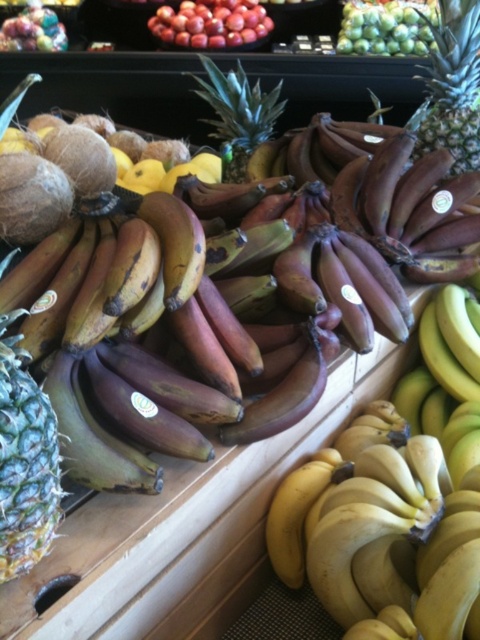
Question: Which object appears farthest from the camera in this image?

Choices:
 (A) yellow textured pineapple at lower left
 (B) shiny red apples at upper center
 (C) green textured pineapple at upper right
 (D) green matte grapes at upper center

Answer: (B)

Question: Is green textured pineapple at upper right behind green matte grapes at upper center?

Choices:
 (A) no
 (B) yes

Answer: (A)

Question: Which point is closer to the camera?

Choices:
 (A) (451, 12)
 (B) (368, 26)

Answer: (A)

Question: Is green spiky pineapple at center to the right of green matte grapes at upper center from the viewer's perspective?

Choices:
 (A) yes
 (B) no

Answer: (B)

Question: Is yellow textured pineapple at lower left closer to the viewer compared to green spiky pineapple at center?

Choices:
 (A) yes
 (B) no

Answer: (A)

Question: Which point is closer to the camera taking this photo?

Choices:
 (A) (249, 92)
 (B) (405, 51)

Answer: (A)